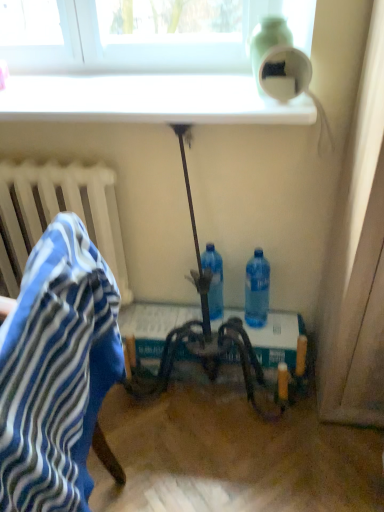
Question: From a real-world perspective, relative to metallic silver table at center, is blue striped fabric at left vertically above or below?

Choices:
 (A) above
 (B) below

Answer: (A)

Question: From the image's perspective, is blue striped fabric at left above or below metallic silver table at center?

Choices:
 (A) above
 (B) below

Answer: (B)

Question: Which of these objects is positioned farthest from the green matte bottle at upper right, which is counted as the 1th bottle, starting from the top?

Choices:
 (A) white glossy window sill at upper center
 (B) blue plastic bottle at lower center, which is the third bottle in top-to-bottom order
 (C) translucent plastic bottle at center, placed as the second bottle when sorted from bottom to top
 (D) metallic silver table at center
 (E) blue striped fabric at left

Answer: (E)

Question: Based on their relative distances, which object is nearer to the translucent plastic bottle at center, placed as the second bottle when sorted from bottom to top?

Choices:
 (A) blue plastic bottle at lower center, which is the third bottle in top-to-bottom order
 (B) green matte bottle at upper right, which is counted as the 1th bottle, starting from the top
 (C) metallic silver table at center
 (D) white glossy window sill at upper center
 (E) blue striped fabric at left

Answer: (A)